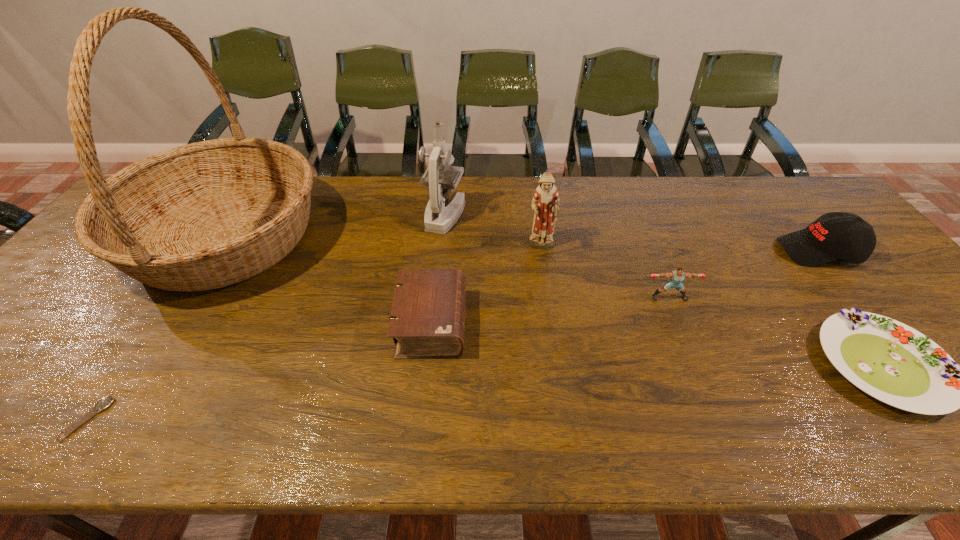
Where is `object at the near edge`? object at the near edge is located at coordinates (105, 402).

In order to click on object that is at the left edge in this screenshot , I will do `click(206, 215)`.

I want to click on object at the right edge, so click(843, 236).

This screenshot has width=960, height=540. What are the coordinates of `object that is at the far left corner` in the screenshot? It's located at (206, 215).

Identify the location of vacant point at the far edge. (380, 184).

The image size is (960, 540). In order to click on vacant area at the near edge in this screenshot , I will do `click(183, 422)`.

Find the location of `free location at the far right corner of the desktop`. free location at the far right corner of the desktop is located at coordinates (808, 217).

Where is `vacant point located between the baseball cap and the sixth tallest object`? The width and height of the screenshot is (960, 540). vacant point located between the baseball cap and the sixth tallest object is located at coordinates (625, 287).

At what (x,y) coordinates should I click in order to perform the action: click on vacant space in between the baseball cap and the seventh shortest object. Please return your answer as a coordinate pair (x, y). The image size is (960, 540). Looking at the image, I should click on (632, 233).

Image resolution: width=960 pixels, height=540 pixels. I want to click on empty space that is in between the third tallest object and the seventh shortest object, so click(x=493, y=231).